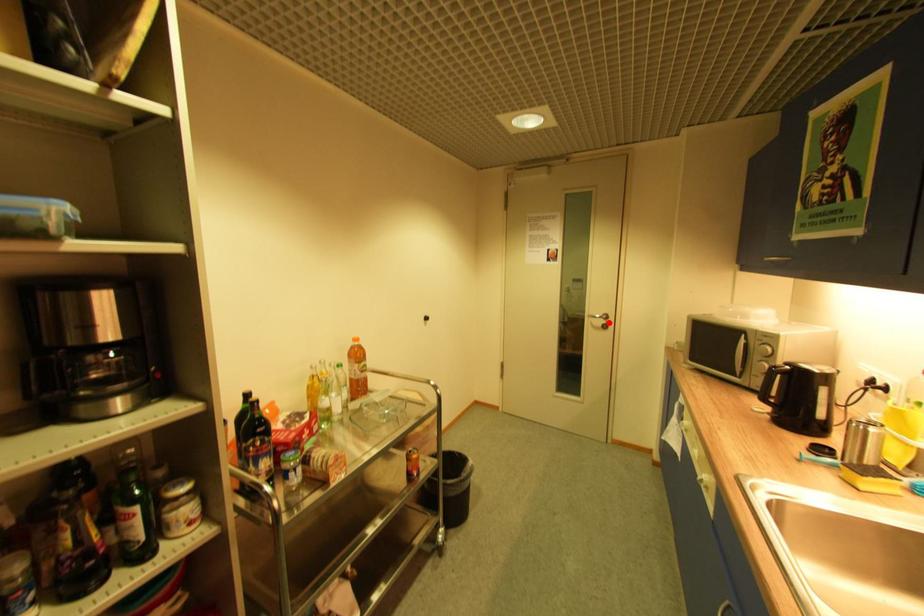
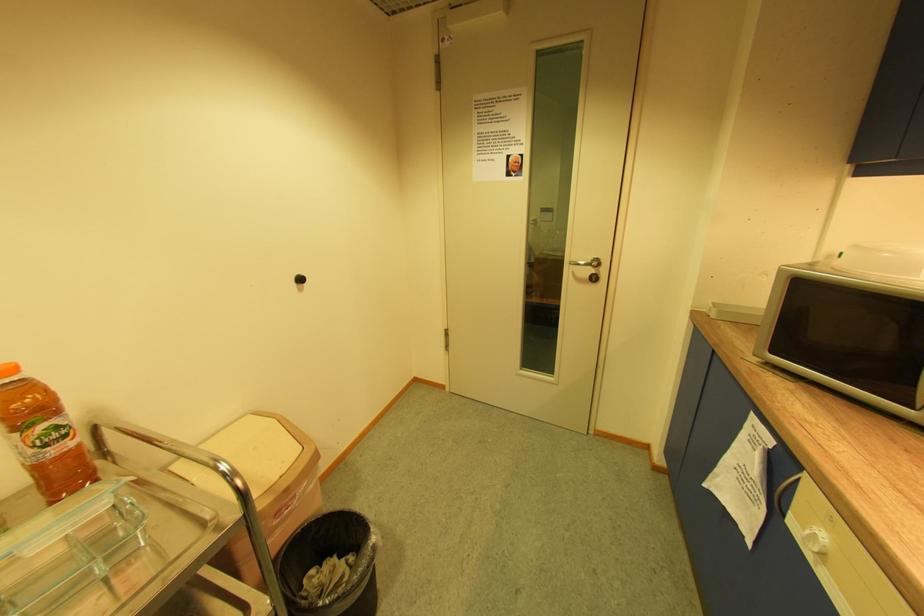
Where in the second image is the point corresponding to the highlighted location from the first image?

(598, 272)